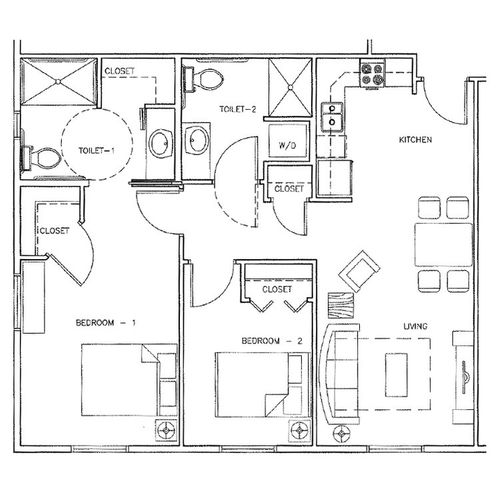
I want to click on bedroom closet, so coord(52,213), coord(71,249), coord(267,291), coord(292,294).